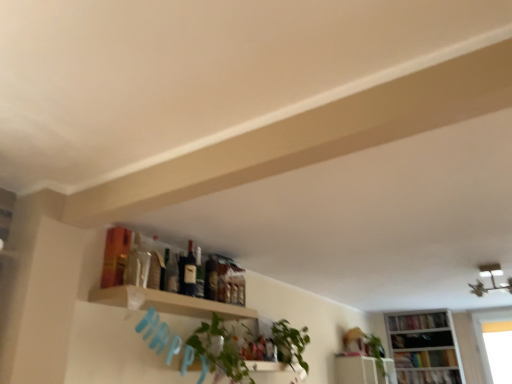
Question: Is point (208, 299) closer or farther from the camera than point (337, 375)?

Choices:
 (A) farther
 (B) closer

Answer: (B)

Question: From the image's perspective, relative to white glossy shelf at upper center, which is the 2th shelf from front to back, is wooden shelf at upper center, the second shelf positioned from the back, above or below?

Choices:
 (A) below
 (B) above

Answer: (B)

Question: Estimate the real-world distances between objects in this image. Which object is closer to the white wooden bookcase at lower right?

Choices:
 (A) matte glass bottle at center, which appears as the 2th bottle when viewed from the back
 (B) hardcover book at upper right, placed as the 1th book when sorted from bottom to top
 (C) matte black bookshelf at upper right, the 3th book ordered from the bottom
 (D) green glass bottle at center, the 2th bottle positioned from the front
 (E) hardcover book at lower right, which appears as the 2th book when viewed from the top

Answer: (E)

Question: Considering the real-world distances, which object is closest to the green glass bottle at center, the 2th bottle positioned from the front?

Choices:
 (A) green leafy plant at center
 (B) hardcover book at upper right, placed as the 1th book when sorted from bottom to top
 (C) green leafy plant at upper center
 (D) matte glass bottle at center, which appears as the 2th bottle when viewed from the back
 (E) white glossy shelf at upper center, which is the 2th shelf from front to back

Answer: (D)